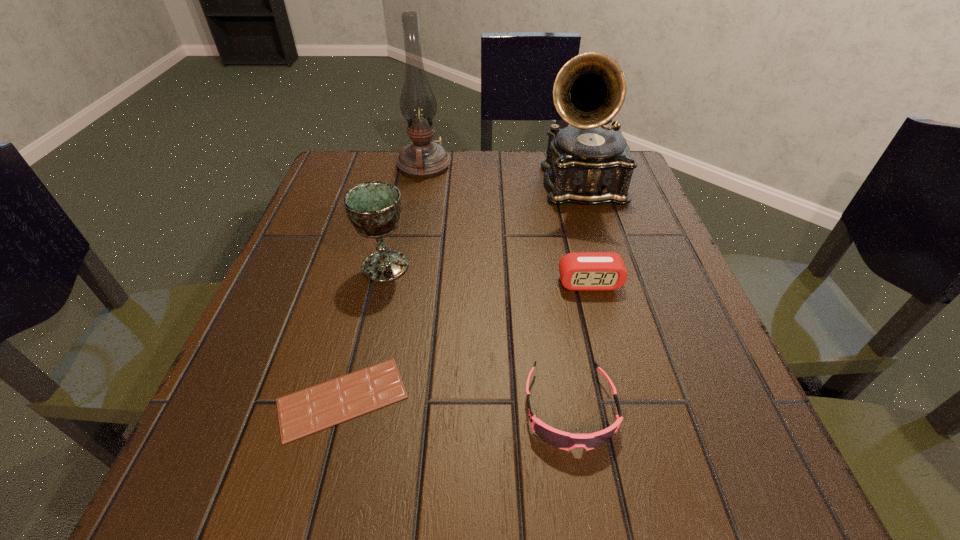
What are the coordinates of `vacant space located 0.050m on the front-facing side of the fifth tallest object` in the screenshot? It's located at (584, 496).

You are a GUI agent. You are given a task and a screenshot of the screen. Output one action in this format:
    pyautogui.click(x=<x>, y=<y>)
    Task: Click on the free point located on the right of the chocolate bar
    The height and width of the screenshot is (540, 960).
    Given the screenshot: What is the action you would take?
    pyautogui.click(x=664, y=399)

Identify the location of oil lamp situated at the far edge. This screenshot has width=960, height=540. (423, 158).

Image resolution: width=960 pixels, height=540 pixels. What are the coordinates of `phonograph record present at the far edge` in the screenshot? It's located at (589, 163).

Locate an element on the screen. This screenshot has width=960, height=540. goggles situated at the near edge is located at coordinates (563, 440).

At what (x,y) coordinates should I click in order to perform the action: click on chocolate bar at the near edge. Please return your answer as a coordinate pair (x, y). Image resolution: width=960 pixels, height=540 pixels. Looking at the image, I should click on (318, 407).

This screenshot has height=540, width=960. Find the location of `oil lamp located in the left edge section of the desktop`. oil lamp located in the left edge section of the desktop is located at coordinates (423, 158).

In order to click on chalice located in the left edge section of the desktop in this screenshot , I will do `click(374, 208)`.

At what (x,y) coordinates should I click in order to perform the action: click on chocolate bar that is at the left edge. Please return your answer as a coordinate pair (x, y). The image size is (960, 540). Looking at the image, I should click on (318, 407).

The image size is (960, 540). In order to click on phonograph record at the right edge in this screenshot , I will do `click(589, 163)`.